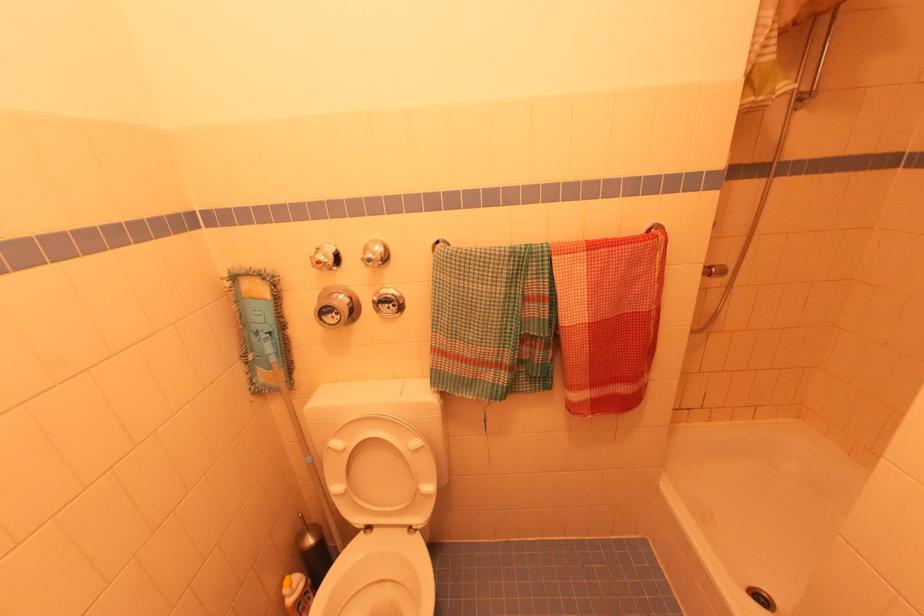
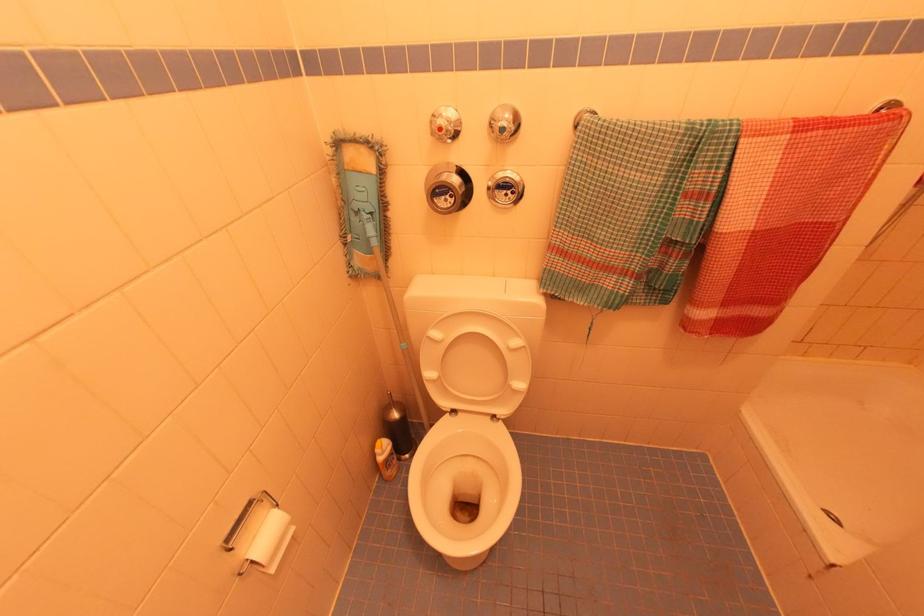
Find the pixel in the second image that matches the point at 377,243 in the first image.

(505, 108)